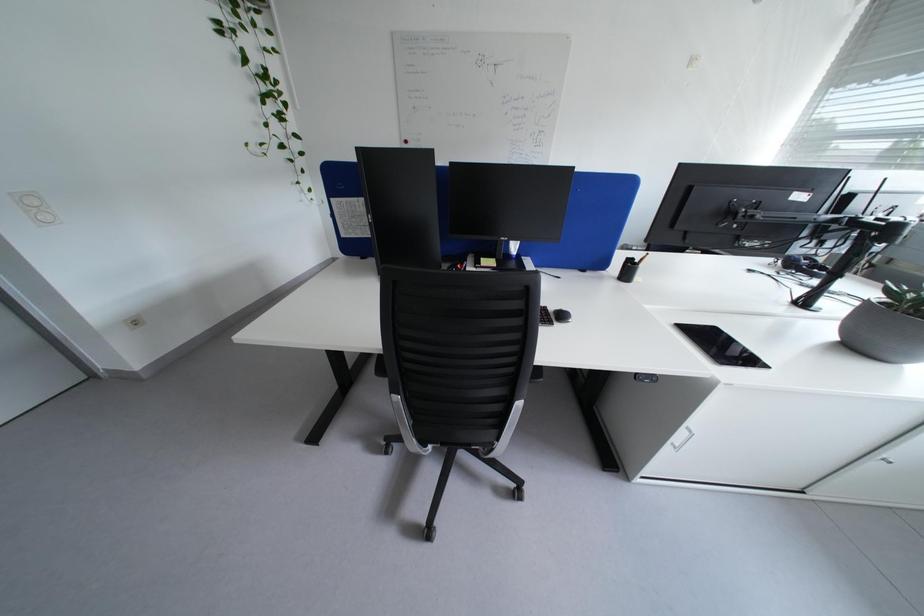
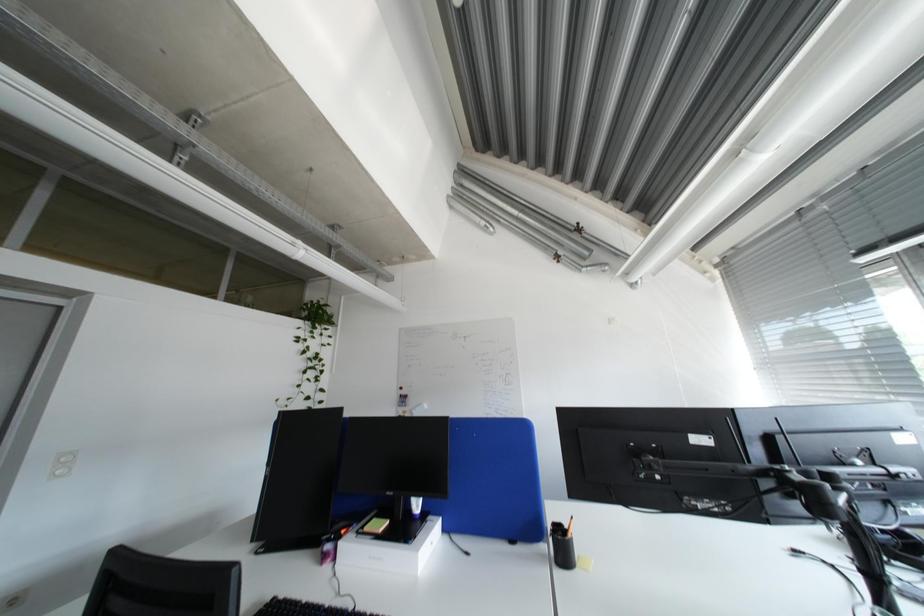
Question: How did the camera likely rotate?

Choices:
 (A) Left
 (B) Right
 (C) Up
 (D) Down

Answer: (C)